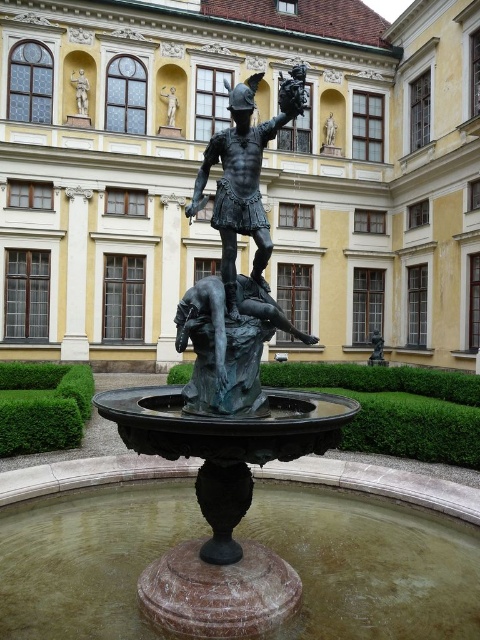
You are a photographer standing at the edge of the courtyard. You want to capture a closeup shot of the bronze statue at upper left. Given that your camera has a maximum zoom range of 50 meters, will you be able to take the photo without moving closer?

The bronze statue at upper left is 53.64 meters away from the camera. Since the camera can only zoom up to 50 meters, you will not be able to take a closeup shot without moving closer.

Looking at this image, you are standing in the courtyard and want to take a photo of the yellow stone palace at center and the bronze statue at center. Which object should you focus on first if you want to capture both in the same frame without moving the camera?

The yellow stone palace at center is positioned over the bronze statue at center, so you should focus on the bronze statue at center first to ensure both are in the frame.

You are an architect planning to install a new lighting system in the courtyard. You need to determine which object, the yellow stone palace at center or the bronze statue at center, requires taller lighting fixtures to properly illuminate its top. Based on the scene description, which object should have taller lights?

The yellow stone palace at center has a greater height compared to the bronze statue at center, so taller lighting fixtures should be installed for the yellow stone palace at center to properly illuminate its top.